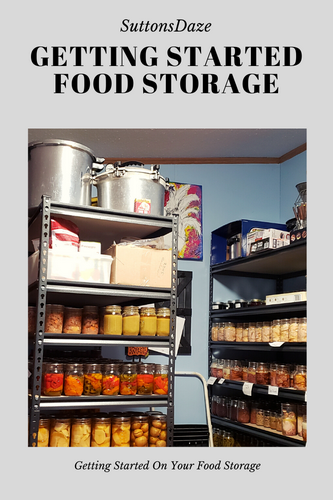
Where is `step stool handle`? step stool handle is located at coordinates pos(182,374).